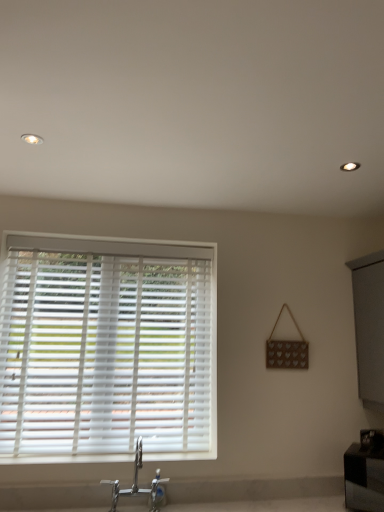
Question: Would you say chrome metallic faucet at lower center is inside or outside white plastic blinds at left?

Choices:
 (A) outside
 (B) inside

Answer: (A)

Question: In terms of size, does chrome metallic faucet at lower center appear bigger or smaller than white plastic blinds at left?

Choices:
 (A) big
 (B) small

Answer: (B)

Question: Which object is the closest to the chrome metallic faucet at lower center?

Choices:
 (A) white plastic blinds at left
 (B) black glossy vanity at lower right

Answer: (A)

Question: Which is farther from the chrome metallic faucet at lower center?

Choices:
 (A) black glossy vanity at lower right
 (B) white plastic blinds at left

Answer: (A)